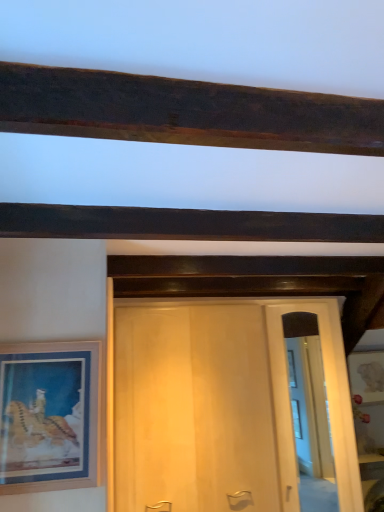
Describe the element at coordinates (184, 224) in the screenshot. The image size is (384, 512). I see `dark wood beam at upper center` at that location.

The width and height of the screenshot is (384, 512). I want to click on clear glass door at center, so click(327, 396).

Can you confirm if wooden picture frame at left is wider than dark wood beam at upper center?

Incorrect, the width of wooden picture frame at left does not surpass that of dark wood beam at upper center.

Considering the positions of objects wooden picture frame at left and dark wood beam at upper center in the image provided, who is more to the left, wooden picture frame at left or dark wood beam at upper center?

From the viewer's perspective, wooden picture frame at left appears more on the left side.

Consider the image. From the image's perspective, is wooden picture frame at left located above or below dark wood beam at upper center?

Based on their image positions, wooden picture frame at left is located beneath dark wood beam at upper center.

In the scene shown: From the image's perspective, between clear glass door at center and wooden picture frame at left, who is located below?

clear glass door at center appears lower in the image.

Who is taller, clear glass door at center or wooden picture frame at left?

Standing taller between the two is clear glass door at center.

Locate an element on the screen. The height and width of the screenshot is (512, 384). picture frame that appears above the clear glass door at center (from the image's perspective) is located at coordinates (49, 416).

Is clear glass door at center oriented away from wooden picture frame at left?

clear glass door at center is not turned away from wooden picture frame at left.

Does wooden picture frame at left appear on the right side of clear glass door at center?

No.

Find the location of a particular element. The width and height of the screenshot is (384, 512). picture frame above the clear glass door at center (from a real-world perspective) is located at coordinates (49, 416).

Considering the positions of points (23, 435) and (333, 304), is point (23, 435) closer to camera compared to point (333, 304)?

Yes, it is.

From the picture: Considering the sizes of objects wooden picture frame at left and clear glass door at center in the image provided, who is smaller, wooden picture frame at left or clear glass door at center?

wooden picture frame at left.

Considering the relative positions of clear glass door at center and dark wood beam at upper center in the image provided, is clear glass door at center to the right of dark wood beam at upper center from the viewer's perspective?

Yes, clear glass door at center is to the right of dark wood beam at upper center.

Is clear glass door at center bigger or smaller than dark wood beam at upper center?

Considering their sizes, clear glass door at center takes up less space than dark wood beam at upper center.

From the image's perspective, between clear glass door at center and dark wood beam at upper center, who is located below?

From the image's view, clear glass door at center is below.

Considering the relative sizes of clear glass door at center and dark wood beam at upper center in the image provided, is clear glass door at center wider than dark wood beam at upper center?

Incorrect, the width of clear glass door at center does not surpass that of dark wood beam at upper center.

Considering the sizes of objects dark wood beam at upper center and clear glass door at center in the image provided, who is thinner, dark wood beam at upper center or clear glass door at center?

clear glass door at center.

Can you confirm if dark wood beam at upper center is bigger than clear glass door at center?

Yes, dark wood beam at upper center is bigger than clear glass door at center.

Between dark wood beam at upper center and clear glass door at center, which one appears on the left side from the viewer's perspective?

dark wood beam at upper center.

Measure the distance from dark wood beam at upper center to clear glass door at center.

1.51 meters.

Visually, is dark wood beam at upper center positioned to the left or to the right of wooden picture frame at left?

Clearly, dark wood beam at upper center is on the right of wooden picture frame at left in the image.

Does dark wood beam at upper center have a greater height compared to wooden picture frame at left?

No, dark wood beam at upper center is not taller than wooden picture frame at left.

Is dark wood beam at upper center in contact with wooden picture frame at left?

No, dark wood beam at upper center is not in contact with wooden picture frame at left.

Based on the photo, from a real-world perspective, between dark wood beam at upper center and wooden picture frame at left, who is vertically lower?

In real-world perspective, wooden picture frame at left is lower.

The image size is (384, 512). What are the coordinates of `picture frame that appears on the left of dark wood beam at upper center` in the screenshot? It's located at (49, 416).

Find the location of a particular element. glass door below the wooden picture frame at left (from a real-world perspective) is located at coordinates pyautogui.click(x=327, y=396).

From the image, which object appears to be farther from clear glass door at center, wooden picture frame at left or dark wood beam at upper center?

The object further to clear glass door at center is wooden picture frame at left.

Consider the image. Estimate the real-world distances between objects in this image. Which object is closer to clear glass door at center, dark wood beam at upper center or wooden picture frame at left?

dark wood beam at upper center is closer to clear glass door at center.

Based on their spatial positions, is wooden picture frame at left or clear glass door at center further from dark wood beam at upper center?

clear glass door at center is positioned further to the anchor dark wood beam at upper center.

When comparing their distances from wooden picture frame at left, does dark wood beam at upper center or clear glass door at center seem further?

Among the two, clear glass door at center is located further to wooden picture frame at left.

Estimate the real-world distances between objects in this image. Which object is further from wooden picture frame at left, clear glass door at center or dark wood beam at upper center?

clear glass door at center lies further to wooden picture frame at left than the other object.

Which object lies further to the anchor point dark wood beam at upper center, clear glass door at center or wooden picture frame at left?

clear glass door at center lies further to dark wood beam at upper center than the other object.

Identify the location of picture frame between dark wood beam at upper center and clear glass door at center in the front-back direction. (49, 416).